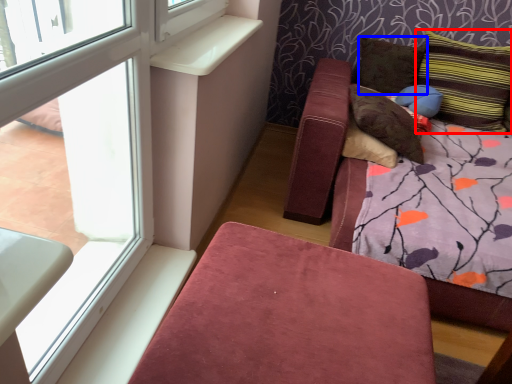
Question: Among these objects, which one is farthest to the camera, pillow (highlighted by a red box) or pillow (highlighted by a blue box)?

Choices:
 (A) pillow
 (B) pillow

Answer: (B)